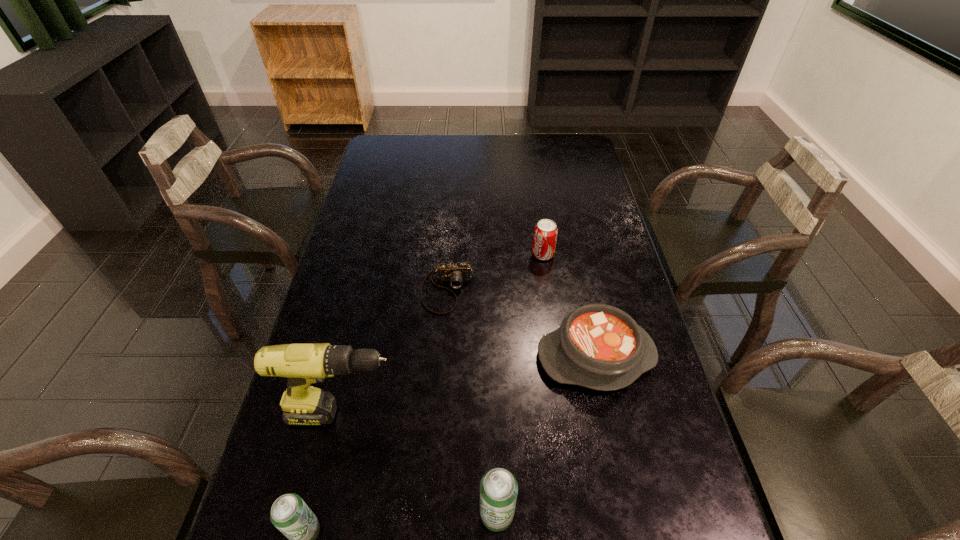
Please point a free position for a beer can on the right. Please provide its 2D coordinates. Your answer should be formatted as a tuple, i.e. [(x, y)], where the tuple contains the x and y coordinates of a point satisfying the conditions above.

[(679, 499)]